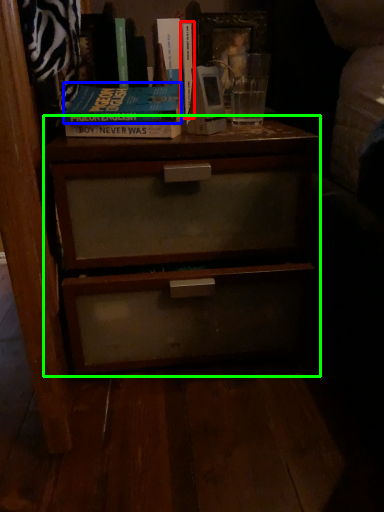
Question: Which object is the closest to the book (highlighted by a red box)? Choose among these: paperback book (highlighted by a blue box) or nightstand (highlighted by a green box).

Choices:
 (A) paperback book
 (B) nightstand

Answer: (A)